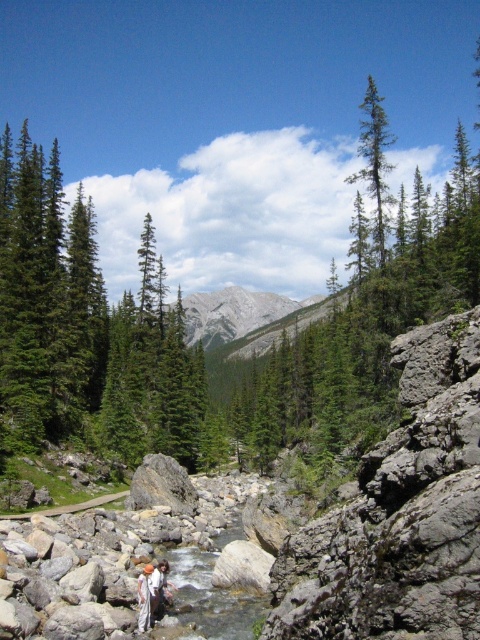
You are a hiker trying to navigate through the rocky stream in the foreground. You notice two trees in the scene, the green matte tree at center and the green matte evergreen tree at upper right. Which tree has a thicker trunk?

The green matte evergreen tree at upper right has a thicker trunk than the green matte tree at center.

You are standing in the valley and see the green matte tree at center and the white cotton clothing at center. Which object is positioned to the left from your perspective?

The green matte tree at center is positioned to the left of the white cotton clothing at center.

You are planning to set up a small campsite in this serene natural landscape. You have a large tent that requires a space as big as the green matte evergreen tree at upper right. Can the white cotton clothing at center provide enough space for your tent?

The green matte evergreen tree at upper right is larger in size than the white cotton clothing at center. Since the tent requires space as big as the tree, the white cotton clothing at center is not large enough to accommodate the tent.